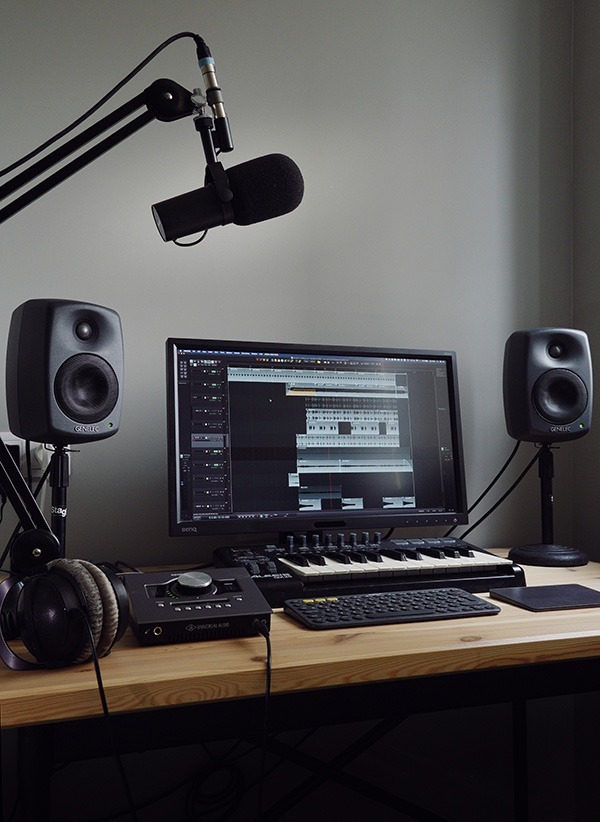
You are a GUI agent. You are given a task and a screenshot of the screen. Output one action in this format:
    pyautogui.click(x=<x>, y=<y>)
    Task: Click on the speaker
    This screenshot has width=600, height=822.
    Given the screenshot: What is the action you would take?
    pyautogui.click(x=547, y=407), pyautogui.click(x=62, y=344)